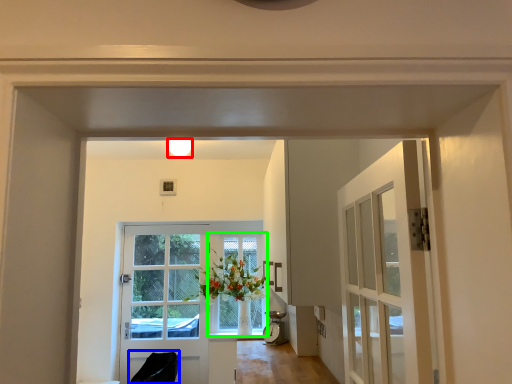
Question: Estimate the real-world distances between objects in this image. Which object is farther from light fixture (highlighted by a red box), chair (highlighted by a blue box) or window (highlighted by a green box)?

Choices:
 (A) chair
 (B) window

Answer: (A)